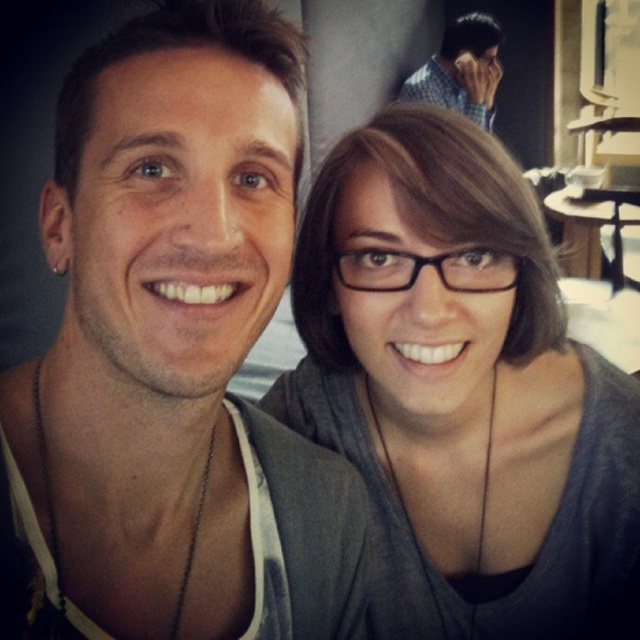
In the scene shown: You are standing in the same room as the two people in the image and want to move from the point marked by the first coordinate to the second coordinate. Which direction should you move to get from point point (152,90) to point (392,353)?

To move from point (152,90) to point (392,353), you should move towards the right and upwards since the second point has a higher x and y coordinate than the first point.

You are a photographer trying to decide which shirt to recommend for a client who wants a slimming effect. Based on the image, which of the following shirts would you suggest between the gray matte shirt at center and the checkered shirt at upper right?

The gray matte shirt at center has a smaller width compared to the checkered shirt at upper right, so it would be the better choice for a slimming effect.

You are a photographer trying to decide where to place a new subject in the photo. The existing subjects are wearing a matte black shirt at center and a gray matte shirt at center. Which shirt should you place further back to make them appear balanced in size?

The matte black shirt at center is smaller than the gray matte shirt at center. To balance their sizes, you should place the smaller matte black shirt at center further back since objects placed farther away appear smaller, which would help them visually align in size with the larger gray matte shirt at center.